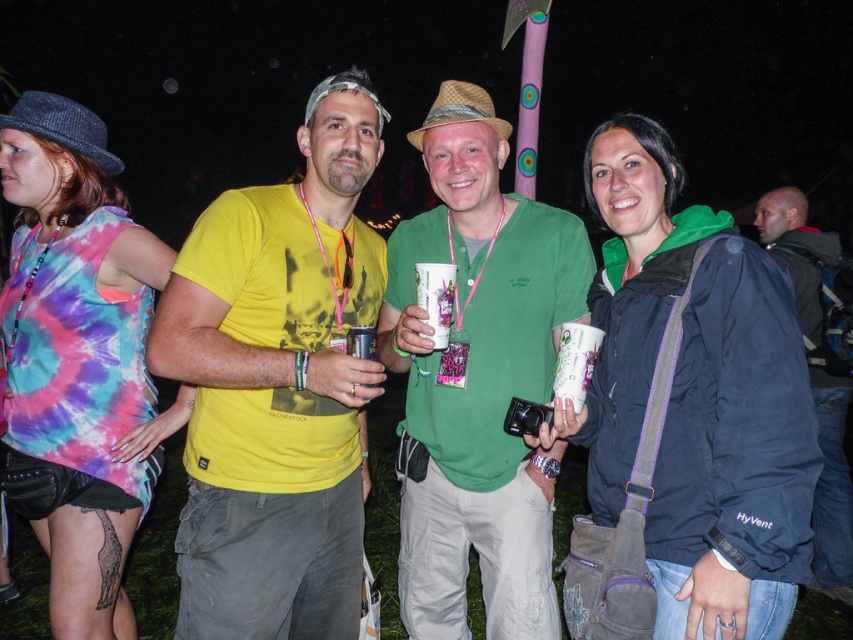
Is hyvent blue jacket at right wider than green matte shirt at center?

No.

Is hyvent blue jacket at right taller than green matte shirt at center?

In fact, hyvent blue jacket at right may be shorter than green matte shirt at center.

Image resolution: width=853 pixels, height=640 pixels. Describe the element at coordinates (695, 397) in the screenshot. I see `hyvent blue jacket at right` at that location.

This screenshot has height=640, width=853. Find the location of `hyvent blue jacket at right`. hyvent blue jacket at right is located at coordinates (695, 397).

Consider the image. Between matte yellow t-shirt at center and hyvent blue jacket at right, which one is positioned lower?

matte yellow t-shirt at center is lower down.

Can you confirm if matte yellow t-shirt at center is smaller than hyvent blue jacket at right?

No, matte yellow t-shirt at center is not smaller than hyvent blue jacket at right.

This screenshot has width=853, height=640. In order to click on matte yellow t-shirt at center in this screenshot , I will do `click(277, 387)`.

I want to click on hyvent blue jacket at right, so click(695, 397).

Is hyvent blue jacket at right positioned before dark blue jacket at right?

Yes, it is in front of dark blue jacket at right.

Between point (722, 570) and point (839, 440), which one is positioned in front?

Point (722, 570)

Find the location of a particular element. hyvent blue jacket at right is located at coordinates (695, 397).